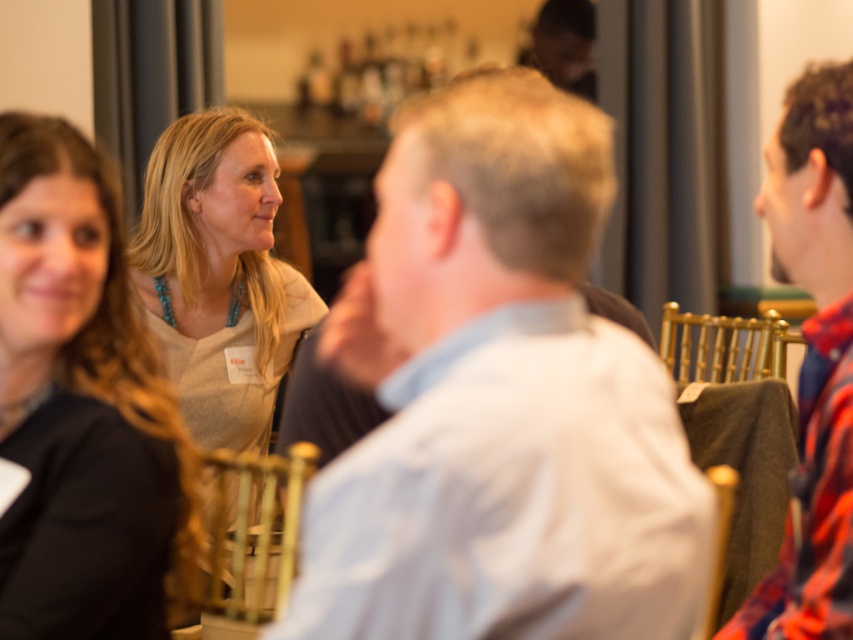
Which is in front, point (459, 250) or point (811, 624)?

Positioned in front is point (459, 250).

Which is above, light blue shirt at center or flannel shirt at right?

flannel shirt at right is higher up.

Between point (439, 420) and point (849, 173), which one is positioned behind?

Point (849, 173)

The image size is (853, 640). Identify the location of light blue shirt at center. (498, 401).

Which is behind, point (492, 163) or point (97, 545)?

Positioned behind is point (97, 545).

Between light blue shirt at center and matte gray sweater at upper left, which one appears on the left side from the viewer's perspective?

matte gray sweater at upper left

Who is more forward, (x=461, y=388) or (x=160, y=540)?

Point (x=461, y=388)

At what (x,y) coordinates should I click in order to perform the action: click on light blue shirt at center. Please return your answer as a coordinate pair (x, y). Image resolution: width=853 pixels, height=640 pixels. Looking at the image, I should click on (498, 401).

Does light beige sweater at center appear over flannel shirt at right?

Indeed, light beige sweater at center is positioned over flannel shirt at right.

Who is higher up, light beige sweater at center or flannel shirt at right?

Positioned higher is light beige sweater at center.

What are the coordinates of `light beige sweater at center` in the screenshot? It's located at (219, 275).